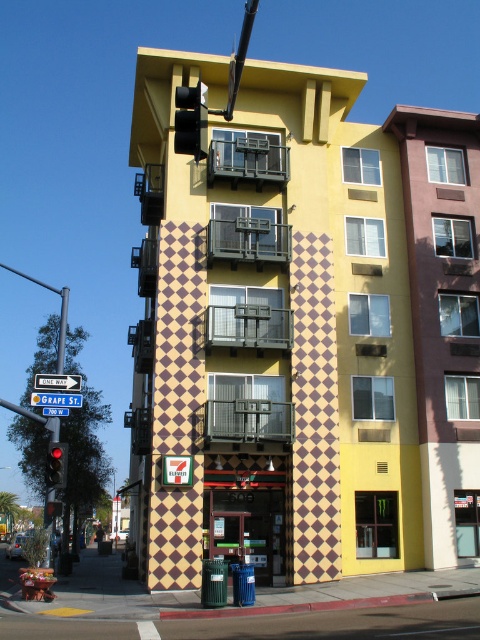
Is point (61, 387) farther from viewer compared to point (70, 404)?

That is True.

Which is below, white plastic street sign at upper left or blue plastic street sign at upper center?

blue plastic street sign at upper center is lower down.

Between point (54, 372) and point (36, 396), which one is positioned in front?

Point (36, 396)

Where is `white plastic street sign at upper left`? The width and height of the screenshot is (480, 640). white plastic street sign at upper left is located at coordinates (57, 381).

Between point (204, 104) and point (58, 460), which one is positioned behind?

The point (58, 460) is behind.

Does metallic traffic light at upper left appear over red glass traffic light at left?

Yes.

Who is more forward, (179,93) or (57,484)?

Point (179,93) is in front.

At what (x,y) coordinates should I click in order to perform the action: click on metallic traffic light at upper left. Please return your answer as a coordinate pair (x, y). Looking at the image, I should click on tap(191, 120).

Which is above, metallic traffic light at upper left or blue plastic street sign at upper center?

metallic traffic light at upper left is higher up.

Is metallic traffic light at upper left smaller than blue plastic street sign at upper center?

No.

What do you see at coordinates (191, 120) in the screenshot? This screenshot has width=480, height=640. I see `metallic traffic light at upper left` at bounding box center [191, 120].

Where is `metallic traffic light at upper left`? metallic traffic light at upper left is located at coordinates (191, 120).